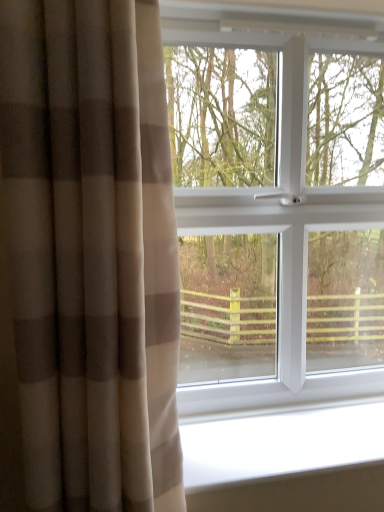
What do you see at coordinates (280, 442) in the screenshot?
I see `white smooth window sill at lower center` at bounding box center [280, 442].

This screenshot has width=384, height=512. Describe the element at coordinates (281, 184) in the screenshot. I see `white plastic window at center` at that location.

In order to click on white plastic window at center in this screenshot , I will do point(281,184).

The height and width of the screenshot is (512, 384). Describe the element at coordinates (91, 253) in the screenshot. I see `beige textured curtain at left` at that location.

Locate an element on the screen. white smooth window sill at lower center is located at coordinates (280, 442).

In the image, is white plastic window at center on the left side or the right side of beige textured curtain at left?

In the image, white plastic window at center appears on the right side of beige textured curtain at left.

Is white plastic window at center oriented towards beige textured curtain at left?

No.

Is white plastic window at center thinner than beige textured curtain at left?

Indeed, white plastic window at center has a lesser width compared to beige textured curtain at left.

Identify the location of window that appears above the beige textured curtain at left (from the image's perspective). (281, 184).

From the image's perspective, would you say beige textured curtain at left is positioned over white smooth window sill at lower center?

Yes, from the image's perspective, beige textured curtain at left is on top of white smooth window sill at lower center.

Is beige textured curtain at left oriented away from white smooth window sill at lower center?

No, beige textured curtain at left is not facing away from white smooth window sill at lower center.

Consider the image. How much distance is there between beige textured curtain at left and white smooth window sill at lower center?

They are 17.10 inches apart.

Where is `curtain lying in front of the white smooth window sill at lower center`? This screenshot has width=384, height=512. curtain lying in front of the white smooth window sill at lower center is located at coordinates (91, 253).

Which is in front, point (244, 461) or point (257, 203)?

The point (244, 461) is more forward.

From a real-world perspective, who is located higher, white smooth window sill at lower center or white plastic window at center?

From a 3D spatial view, white plastic window at center is above.

Which object is thinner, white smooth window sill at lower center or white plastic window at center?

white plastic window at center.

Can you confirm if beige textured curtain at left is thinner than white plastic window at center?

In fact, beige textured curtain at left might be wider than white plastic window at center.

Which of these two, beige textured curtain at left or white plastic window at center, stands taller?

white plastic window at center is taller.

How far apart are beige textured curtain at left and white plastic window at center?

The distance of beige textured curtain at left from white plastic window at center is 17.95 inches.

Is point (82, 350) more distant than point (304, 102)?

No, (82, 350) is closer to viewer.

Does white plastic window at center have a greater width compared to white smooth window sill at lower center?

In fact, white plastic window at center might be narrower than white smooth window sill at lower center.

How many degrees apart are the facing directions of white plastic window at center and white smooth window sill at lower center?

The angular difference between white plastic window at center and white smooth window sill at lower center is 0.00122 degrees.

Consider the image. Between white plastic window at center and white smooth window sill at lower center, which one has more height?

Standing taller between the two is white plastic window at center.

Based on their sizes in the image, would you say white plastic window at center is bigger or smaller than white smooth window sill at lower center?

In the image, white plastic window at center appears to be larger than white smooth window sill at lower center.

Does white smooth window sill at lower center have a greater height compared to beige textured curtain at left?

In fact, white smooth window sill at lower center may be shorter than beige textured curtain at left.

Which of these two, white smooth window sill at lower center or beige textured curtain at left, is smaller?

white smooth window sill at lower center is smaller.

Between point (364, 444) and point (122, 306), which one is positioned in front?

The point (122, 306) is more forward.

Measure the distance from white smooth window sill at lower center to beige textured curtain at left.

white smooth window sill at lower center and beige textured curtain at left are 17.10 inches apart from each other.

Find the location of a particular element. The width and height of the screenshot is (384, 512). curtain that appears in front of the white plastic window at center is located at coordinates (91, 253).

Where is `window sill on the right of beige textured curtain at left`? window sill on the right of beige textured curtain at left is located at coordinates (280, 442).

Estimate the real-world distances between objects in this image. Which object is closer to white smooth window sill at lower center, beige textured curtain at left or white plastic window at center?

white plastic window at center is closer to white smooth window sill at lower center.

Based on their spatial positions, is white plastic window at center or white smooth window sill at lower center further from beige textured curtain at left?

white plastic window at center lies further to beige textured curtain at left than the other object.

From the image, which object appears to be farther from beige textured curtain at left, white smooth window sill at lower center or white plastic window at center?

The object further to beige textured curtain at left is white plastic window at center.

Estimate the real-world distances between objects in this image. Which object is closer to white plastic window at center, beige textured curtain at left or white smooth window sill at lower center?

The object closer to white plastic window at center is white smooth window sill at lower center.

When comparing their distances from white smooth window sill at lower center, does white plastic window at center or beige textured curtain at left seem closer?

white plastic window at center is closer to white smooth window sill at lower center.

Which object lies further to the anchor point white plastic window at center, white smooth window sill at lower center or beige textured curtain at left?

Among the two, beige textured curtain at left is located further to white plastic window at center.

This screenshot has height=512, width=384. I want to click on curtain between white plastic window at center and white smooth window sill at lower center in the vertical direction, so click(x=91, y=253).